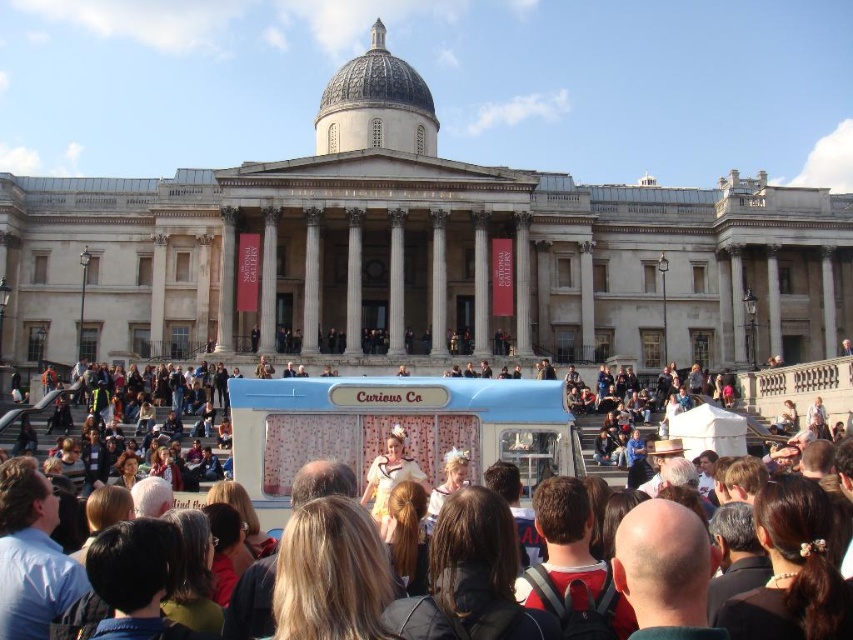
Which of these two, matte white ice cream truck at center or blue fabric food truck at center, stands taller?

matte white ice cream truck at center

Can you confirm if matte white ice cream truck at center is positioned to the right of blue fabric food truck at center?

Yes, matte white ice cream truck at center is to the right of blue fabric food truck at center.

Between point (704, 406) and point (426, 410), which one is positioned in front?

Point (426, 410) is more forward.

The image size is (853, 640). In order to click on matte white ice cream truck at center in this screenshot , I will do `click(392, 424)`.